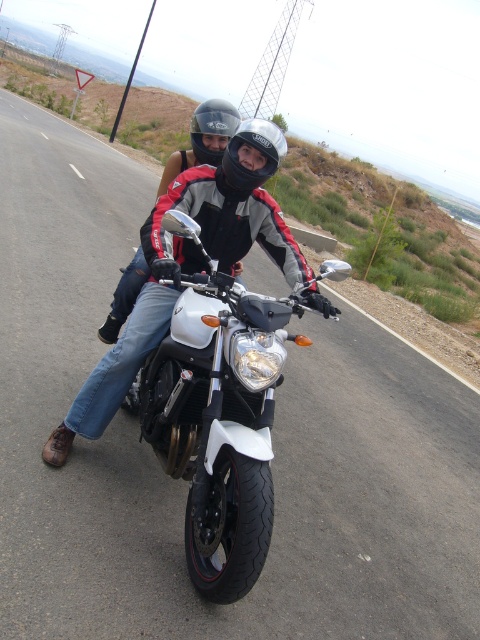
Question: Does black matte helmet at center have a lesser width compared to glossy black helmet at center?

Choices:
 (A) no
 (B) yes

Answer: (B)

Question: Which of these objects is positioned closest to the white matte motorcycle at center?

Choices:
 (A) black matte helmet at center
 (B) glossy black helmet at center
 (C) matte black motorcycle at center

Answer: (C)

Question: Which point is farther to the camera?

Choices:
 (A) black matte helmet at center
 (B) glossy black helmet at center
 (C) matte black motorcycle at center
 (D) white matte motorcycle at center

Answer: (B)

Question: Can you confirm if white matte motorcycle at center is positioned above black matte helmet at center?

Choices:
 (A) no
 (B) yes

Answer: (A)

Question: Where is white matte motorcycle at center located in relation to matte black motorcycle at center in the image?

Choices:
 (A) left
 (B) right

Answer: (B)

Question: Among these objects, which one is nearest to the camera?

Choices:
 (A) white matte motorcycle at center
 (B) black matte helmet at center

Answer: (A)